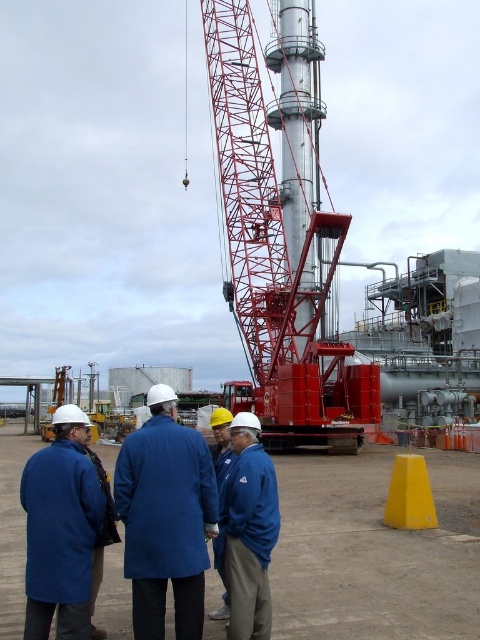
You are operating a drone that needs to fly over the industrial site to capture aerial footage. The drone has a safety protocol that requires it to maintain a minimum altitude of 10 meters above any object. Given that the red metallic crane at center has a height of 15 meters, what is the minimum safe altitude the drone should fly at to comply with the safety protocol?

The red metallic crane at center is 15 meters tall, so the drone must fly at least 10 meters above it. Therefore, the minimum safe altitude is 15 meters plus 10 meters, totaling 25 meters.

You are a construction worker needing to reach the yellow matte cone at lower right. From your current position near the blue matte jacket at lower left, which direction should you move to get closer to the cone?

The blue matte jacket at lower left is in front of the yellow matte cone at lower right, so to reach the cone, you should move backward away from the jacket towards the cone.